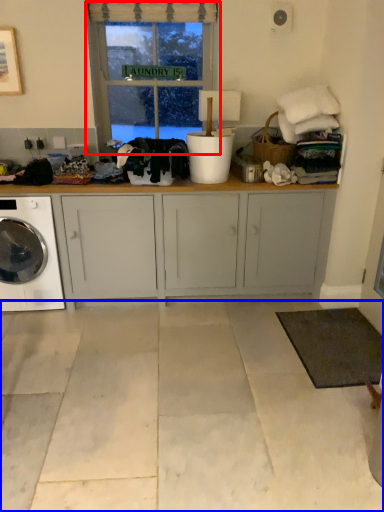
Question: Which object appears farthest to the camera in this image, window (highlighted by a red box) or concrete (highlighted by a blue box)?

Choices:
 (A) window
 (B) concrete

Answer: (A)